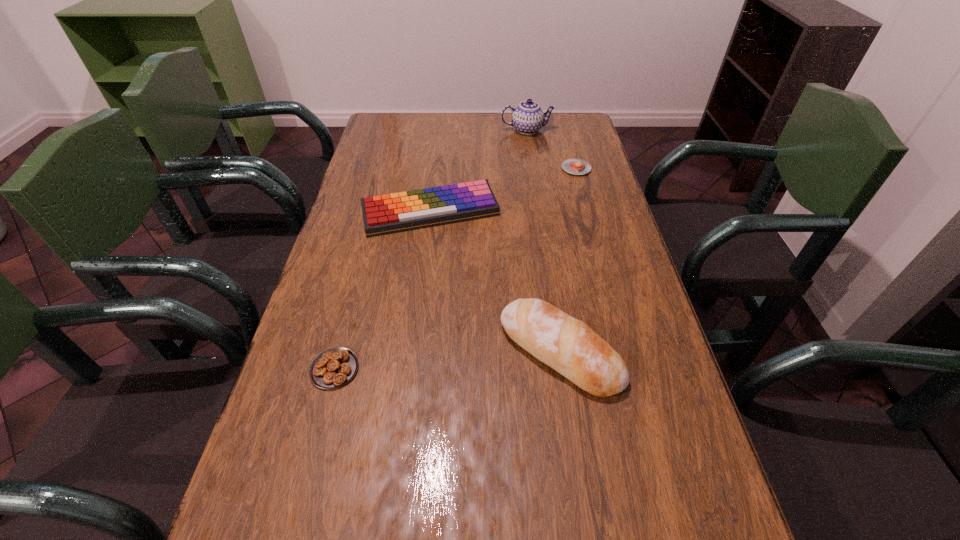
At what (x,y) coordinates should I click in order to perform the action: click on empty space that is in between the farther pastry and the tallest object. Please return your answer as a coordinate pair (x, y). The image size is (960, 540). Looking at the image, I should click on (552, 150).

Image resolution: width=960 pixels, height=540 pixels. Find the location of `the third closest object relative to the second farthest object`. the third closest object relative to the second farthest object is located at coordinates (569, 346).

Locate which object is the fourth closest to the right pastry. Please provide its 2D coordinates. Your answer should be formatted as a tuple, i.e. [(x, y)], where the tuple contains the x and y coordinates of a point satisfying the conditions above.

[(332, 368)]

Locate an element on the screen. The width and height of the screenshot is (960, 540). free spot that satisfies the following two spatial constraints: 1. on the back side of the farther pastry; 2. on the right side of the second tallest object is located at coordinates (533, 168).